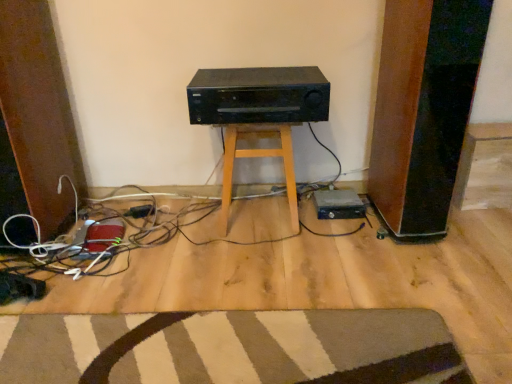
Where is `free space to the back side of black plastic plug at lower center`? This screenshot has height=384, width=512. free space to the back side of black plastic plug at lower center is located at coordinates [143, 201].